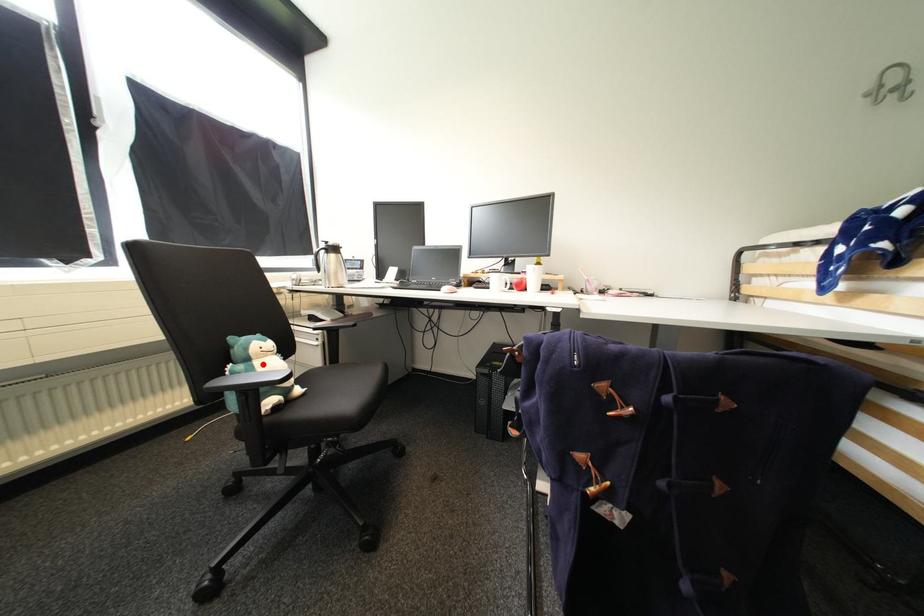
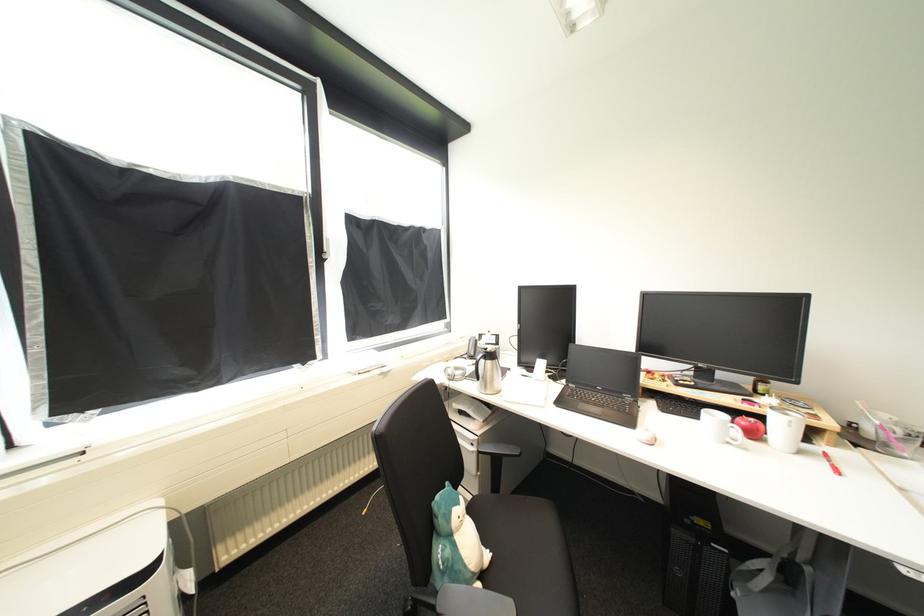
In the second image, find the point that corresponds to the highlighted location in the first image.

(464, 538)